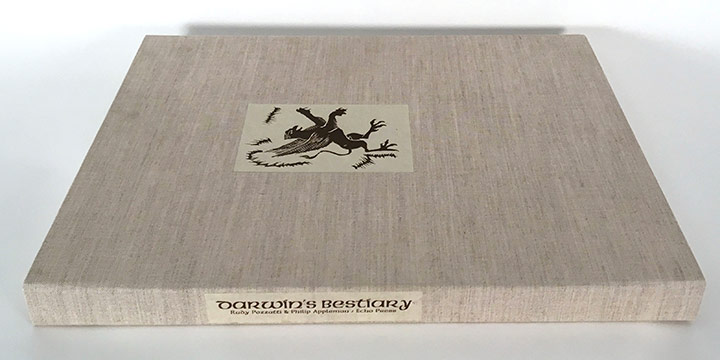
At what (x,y) coordinates should I click in order to perform the action: click on tabletop. Please return your answer as a coordinate pair (x, y). Looking at the image, I should click on (52, 67).